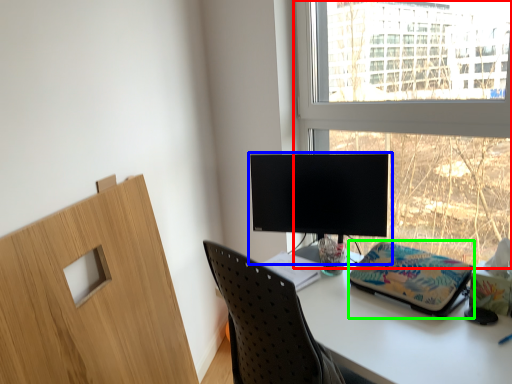
Question: Based on their relative distances, which object is farther from window (highlighted by a red box)? Choose from computer monitor (highlighted by a blue box) and stationery (highlighted by a green box).

Choices:
 (A) computer monitor
 (B) stationery

Answer: (B)